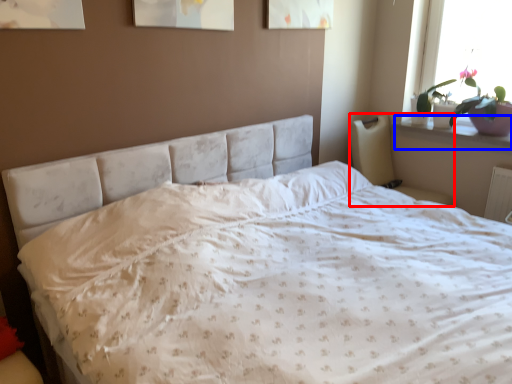
Question: Which object is closer to the camera taking this photo, armchair (highlighted by a red box) or window sill (highlighted by a blue box)?

Choices:
 (A) armchair
 (B) window sill

Answer: (A)